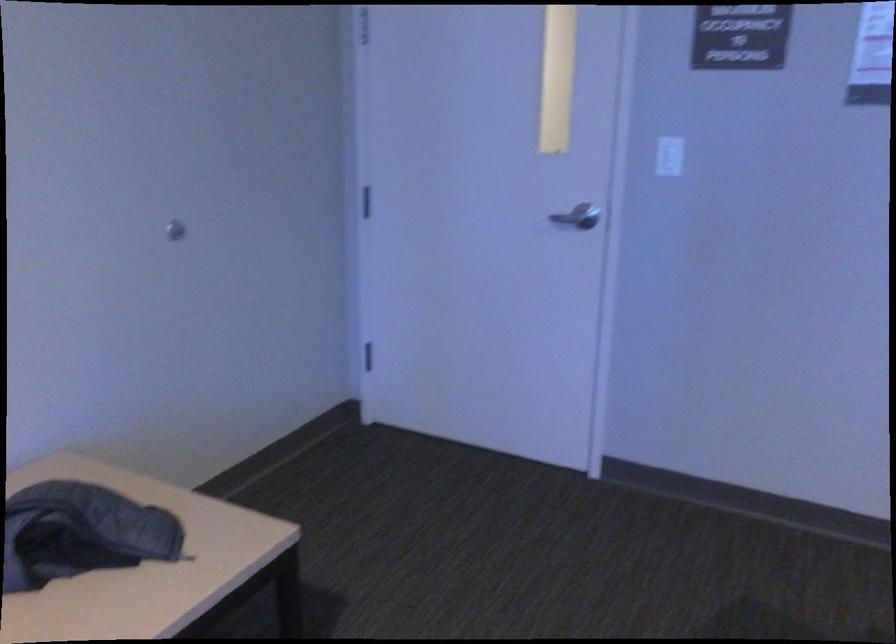
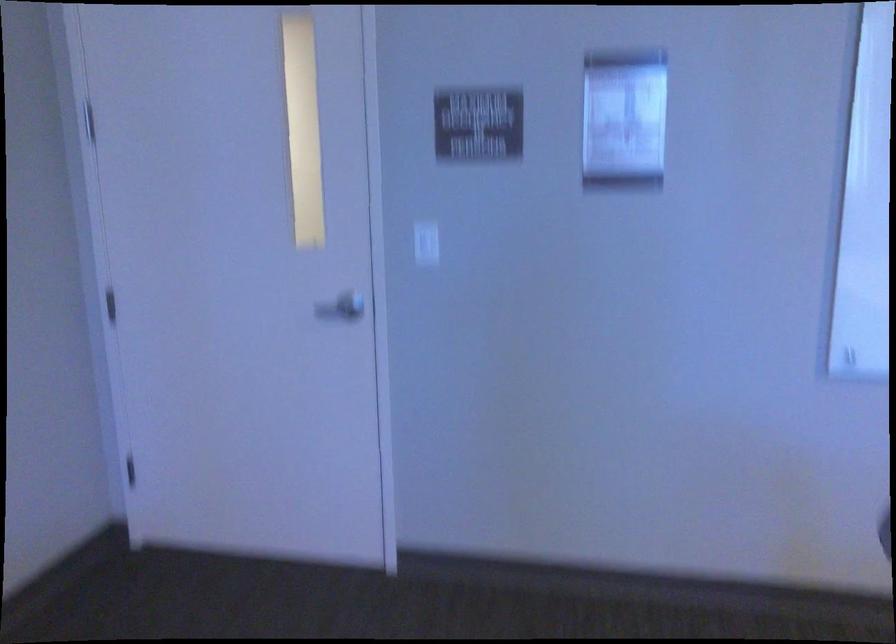
Question: Based on the continuous images, in which direction is the camera rotating? Reply with the corresponding letter.

Choices:
 (A) Left
 (B) Right
 (C) Up
 (D) Down

Answer: (B)